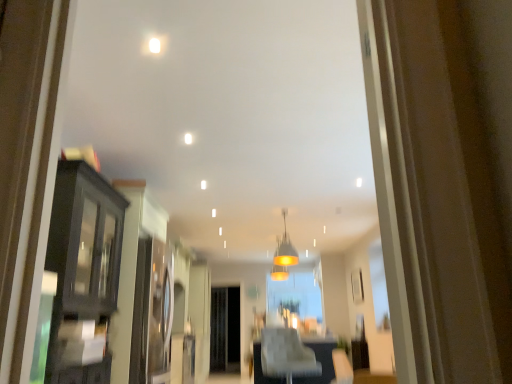
Question: Does matte black cabinet at left have a greater width compared to white leather chair at center?

Choices:
 (A) no
 (B) yes

Answer: (B)

Question: Is matte black cabinet at left shorter than white leather chair at center?

Choices:
 (A) no
 (B) yes

Answer: (A)

Question: Is matte black cabinet at left bigger than white leather chair at center?

Choices:
 (A) yes
 (B) no

Answer: (A)

Question: From the image's perspective, is matte black cabinet at left above white leather chair at center?

Choices:
 (A) no
 (B) yes

Answer: (B)

Question: Could you tell me if matte black cabinet at left is facing white leather chair at center?

Choices:
 (A) no
 (B) yes

Answer: (B)

Question: From their relative heights in the image, would you say matte black cabinet at left is taller or shorter than white leather chair at center?

Choices:
 (A) short
 (B) tall

Answer: (B)

Question: From a real-world perspective, relative to white leather chair at center, is matte black cabinet at left vertically above or below?

Choices:
 (A) below
 (B) above

Answer: (B)

Question: In terms of size, does matte black cabinet at left appear bigger or smaller than white leather chair at center?

Choices:
 (A) small
 (B) big

Answer: (B)

Question: Choose the correct answer: Is matte black cabinet at left inside white leather chair at center or outside it?

Choices:
 (A) outside
 (B) inside

Answer: (A)

Question: In terms of width, does clear glass door at center look wider or thinner when compared to matte glass pendant light at center?

Choices:
 (A) wide
 (B) thin

Answer: (A)

Question: In terms of height, does clear glass door at center look taller or shorter compared to matte glass pendant light at center?

Choices:
 (A) short
 (B) tall

Answer: (B)

Question: Considering the positions of clear glass door at center and matte glass pendant light at center in the image, is clear glass door at center bigger or smaller than matte glass pendant light at center?

Choices:
 (A) small
 (B) big

Answer: (B)

Question: Is clear glass door at center spatially inside matte glass pendant light at center, or outside of it?

Choices:
 (A) outside
 (B) inside

Answer: (A)

Question: Based on their sizes in the image, would you say matte black cabinet at left is bigger or smaller than matte glass pendant light at center?

Choices:
 (A) small
 (B) big

Answer: (B)

Question: Is matte black cabinet at left wider or thinner than matte glass pendant light at center?

Choices:
 (A) thin
 (B) wide

Answer: (B)